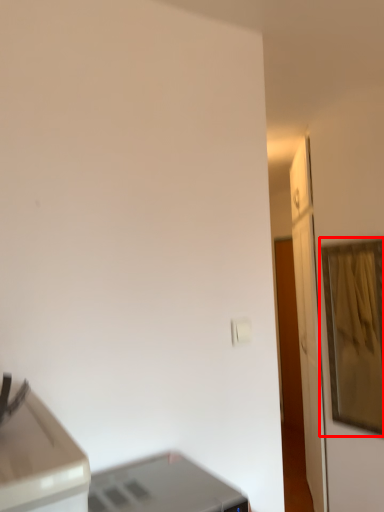
Question: From the image's perspective, where is picture frame (annotated by the red box) located relative to printer?

Choices:
 (A) below
 (B) above

Answer: (B)